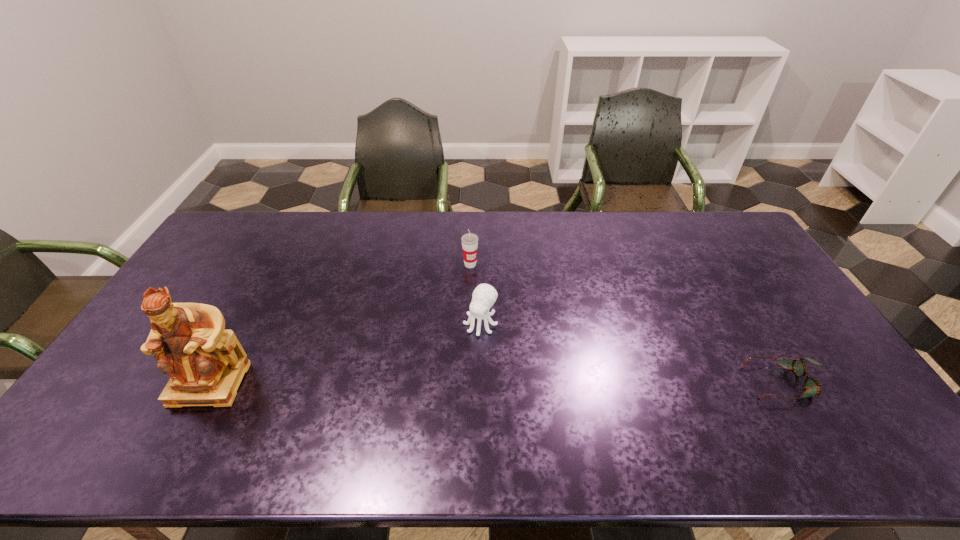
The image size is (960, 540). In order to click on free spot located on the front-facing side of the shortest object in this screenshot , I will do `click(658, 383)`.

You are a GUI agent. You are given a task and a screenshot of the screen. Output one action in this format:
    pyautogui.click(x=<x>, y=<y>)
    Task: Click on the vacant region located on the front-facing side of the second shortest object
    This screenshot has width=960, height=540.
    Given the screenshot: What is the action you would take?
    pyautogui.click(x=433, y=395)

I want to click on blank space located on the front-facing side of the second shortest object, so click(x=433, y=395).

Identify the location of vacant space situated on the front-facing side of the second shortest object. (431, 399).

This screenshot has width=960, height=540. In order to click on vacant area situated 0.270m on the side of the farthest object with the logo in this screenshot , I will do `click(514, 322)`.

This screenshot has width=960, height=540. I want to click on vacant region located 0.320m on the side of the farthest object with the logo, so click(521, 334).

Find the location of a particular element. The image size is (960, 540). vacant position located on the side of the farthest object with the logo is located at coordinates (505, 312).

Where is `figurine at the near edge`? The width and height of the screenshot is (960, 540). figurine at the near edge is located at coordinates (206, 363).

The height and width of the screenshot is (540, 960). What are the coordinates of `spectacles present at the near edge` in the screenshot? It's located at [x=812, y=386].

This screenshot has width=960, height=540. What are the coordinates of `object positioned at the right edge` in the screenshot? It's located at (812, 386).